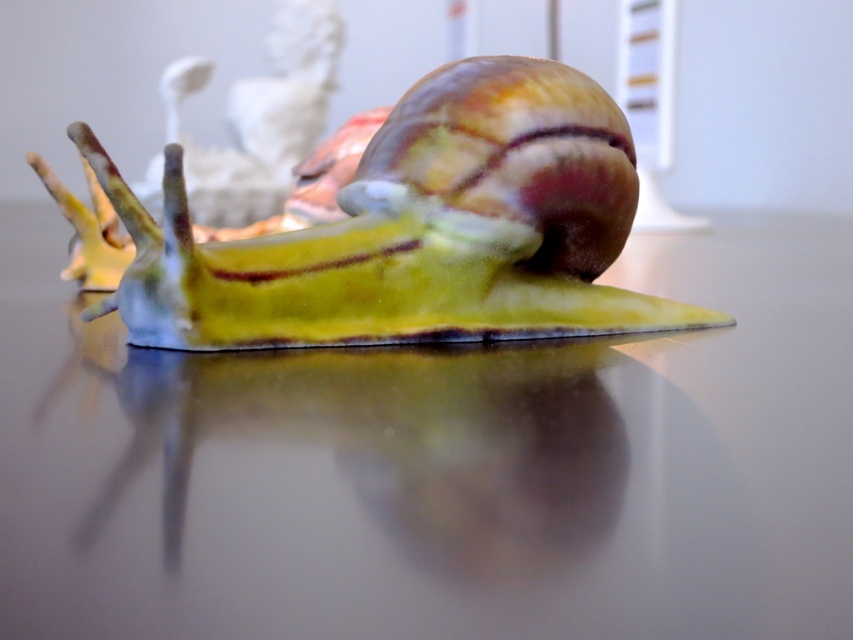
Can you confirm if glossy glass table at center is positioned below shiny green snail at center?

Yes.

Who is shorter, glossy glass table at center or shiny green snail at center?

glossy glass table at center is shorter.

Is point (817, 429) behind point (349, 228)?

That is False.

This screenshot has width=853, height=640. Find the location of `glossy glass table at center`. glossy glass table at center is located at coordinates (439, 465).